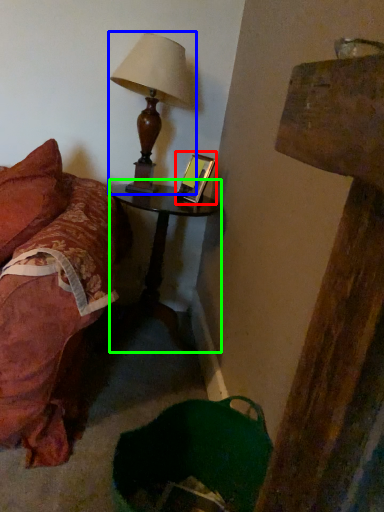
Question: Which object is the farthest from picture frame (highlighted by a red box)? Choose among these: lamp (highlighted by a blue box) or nightstand (highlighted by a green box).

Choices:
 (A) lamp
 (B) nightstand

Answer: (B)